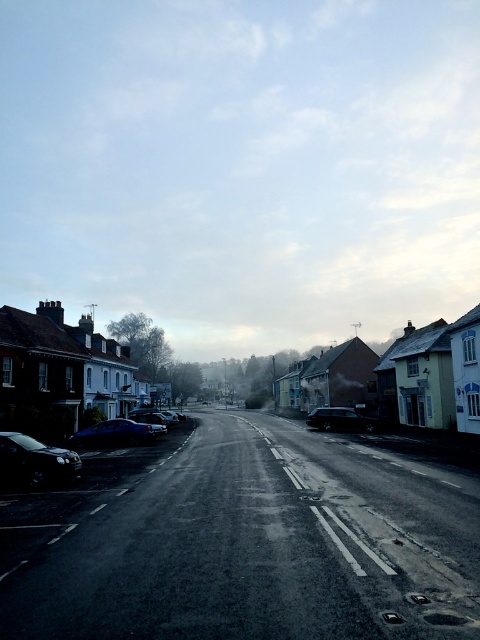
Question: Can you confirm if shiny black car at lower left is wider than shiny blue car at left?

Choices:
 (A) no
 (B) yes

Answer: (A)

Question: Which point is farther to the camera?

Choices:
 (A) (164, 419)
 (B) (360, 420)
 (C) (144, 433)

Answer: (A)

Question: Which object is closer to the camera taking this photo?

Choices:
 (A) shiny black car at center
 (B) shiny black car at lower left
 (C) shiny blue car at left

Answer: (B)

Question: Estimate the real-world distances between objects in this image. Which object is farther from the shiny blue car at left?

Choices:
 (A) metallic blue car at center
 (B) shiny black car at lower left
 (C) shiny black car at center

Answer: (C)

Question: Is the position of shiny black car at lower left less distant than that of metallic blue car at center?

Choices:
 (A) no
 (B) yes

Answer: (B)

Question: Observing the image, what is the correct spatial positioning of shiny black car at lower left in reference to metallic blue car at center?

Choices:
 (A) right
 (B) left

Answer: (A)